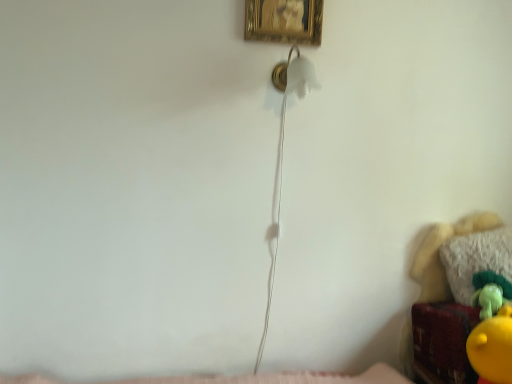
Question: Does gold textured picture frame at upper center lie in front of velvet plush toy at lower right?

Choices:
 (A) no
 (B) yes

Answer: (A)

Question: Is velvet plush toy at lower right inside gold textured picture frame at upper center?

Choices:
 (A) yes
 (B) no

Answer: (B)

Question: Is gold textured picture frame at upper center wider than velvet plush toy at lower right?

Choices:
 (A) yes
 (B) no

Answer: (B)

Question: Is gold textured picture frame at upper center far away from velvet plush toy at lower right?

Choices:
 (A) no
 (B) yes

Answer: (B)

Question: From a real-world perspective, is gold textured picture frame at upper center on top of velvet plush toy at lower right?

Choices:
 (A) yes
 (B) no

Answer: (A)

Question: Is white fluffy pillow at lower right taller or shorter than velvet plush toy at lower right?

Choices:
 (A) short
 (B) tall

Answer: (A)

Question: Considering the positions of point (450, 261) and point (463, 221), is point (450, 261) closer or farther from the camera than point (463, 221)?

Choices:
 (A) closer
 (B) farther

Answer: (A)

Question: Considering the relative positions of white fluffy pillow at lower right and velvet plush toy at lower right in the image provided, is white fluffy pillow at lower right to the left or to the right of velvet plush toy at lower right?

Choices:
 (A) right
 (B) left

Answer: (A)

Question: Looking at their shapes, would you say white fluffy pillow at lower right is wider or thinner than velvet plush toy at lower right?

Choices:
 (A) wide
 (B) thin

Answer: (B)

Question: Is gold textured picture frame at upper center spatially inside velvet plush toy at lower right, or outside of it?

Choices:
 (A) outside
 (B) inside

Answer: (A)

Question: Looking at the image, does gold textured picture frame at upper center seem bigger or smaller compared to velvet plush toy at lower right?

Choices:
 (A) small
 (B) big

Answer: (A)

Question: In the image, is gold textured picture frame at upper center positioned in front of or behind velvet plush toy at lower right?

Choices:
 (A) behind
 (B) front

Answer: (A)

Question: In terms of height, does gold textured picture frame at upper center look taller or shorter compared to velvet plush toy at lower right?

Choices:
 (A) short
 (B) tall

Answer: (A)

Question: Does point (429, 299) appear closer or farther from the camera than point (250, 23)?

Choices:
 (A) closer
 (B) farther

Answer: (B)

Question: Based on their sizes in the image, would you say velvet plush toy at lower right is bigger or smaller than gold textured picture frame at upper center?

Choices:
 (A) big
 (B) small

Answer: (A)